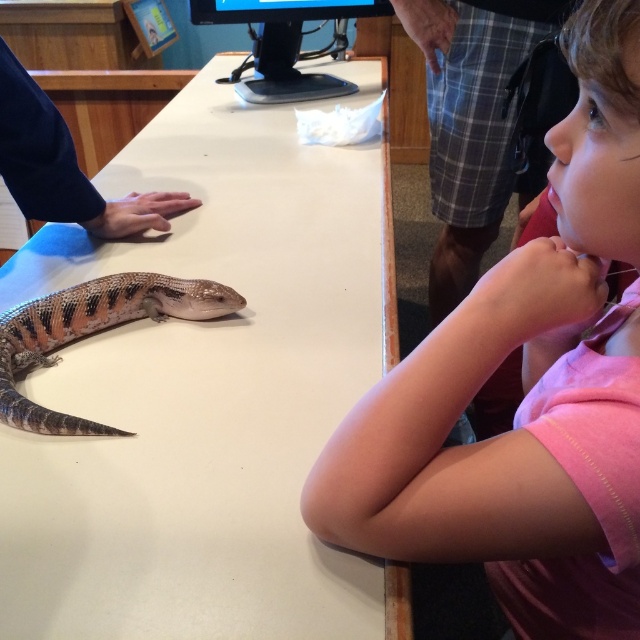
Question: Is white smooth table at center to the left of black glossy computer monitor at upper center from the viewer's perspective?

Choices:
 (A) yes
 (B) no

Answer: (A)

Question: Is slate blue scaly lizard at center smaller than black glossy computer monitor at upper center?

Choices:
 (A) yes
 (B) no

Answer: (A)

Question: Among these points, which one is farthest from the camera?

Choices:
 (A) (298, 612)
 (B) (540, 634)
 (C) (300, 44)

Answer: (C)

Question: Does pink cotton shirt at upper right have a larger size compared to black glossy computer monitor at upper center?

Choices:
 (A) yes
 (B) no

Answer: (A)

Question: Estimate the real-world distances between objects in this image. Which object is farther from the slate blue scaly lizard at center?

Choices:
 (A) pink cotton shirt at upper right
 (B) white smooth table at center
 (C) black glossy computer monitor at upper center

Answer: (C)

Question: Which object is the farthest from the white smooth table at center?

Choices:
 (A) pink cotton shirt at upper right
 (B) slate blue scaly lizard at center

Answer: (A)